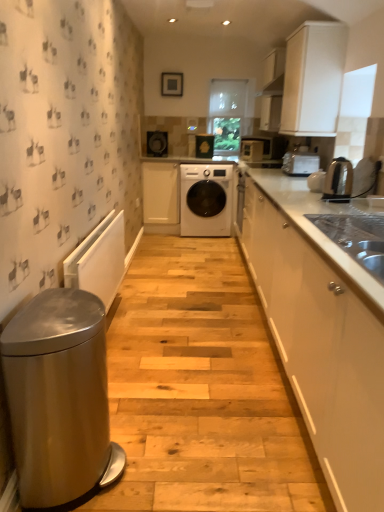
Locate an element on the screen. The height and width of the screenshot is (512, 384). vacant space to the right of polished stainless steel trash can at left is located at coordinates (172, 466).